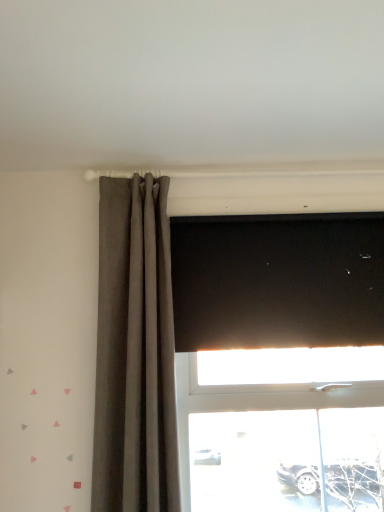
What do you see at coordinates (278, 281) in the screenshot? I see `black matte blind at upper center` at bounding box center [278, 281].

Find the location of a particular element. This screenshot has height=512, width=384. black matte blind at upper center is located at coordinates (278, 281).

At what (x,y) coordinates should I click in order to perform the action: click on matte gray curtain at left. Please return your answer as a coordinate pair (x, y). The image size is (384, 512). Looking at the image, I should click on (135, 352).

What do you see at coordinates (135, 352) in the screenshot? I see `matte gray curtain at left` at bounding box center [135, 352].

Locate an element on the screen. black matte blind at upper center is located at coordinates (278, 281).

Does black matte blind at upper center appear on the right side of matte gray curtain at left?

Indeed, black matte blind at upper center is positioned on the right side of matte gray curtain at left.

In the image, is black matte blind at upper center positioned in front of or behind matte gray curtain at left?

black matte blind at upper center is behind matte gray curtain at left.

Is point (338, 318) closer or farther from the camera than point (103, 306)?

Point (338, 318).

From the image's perspective, is black matte blind at upper center under matte gray curtain at left?

No.

From a real-world perspective, does black matte blind at upper center sit lower than matte gray curtain at left?

Incorrect, from a real-world perspective, black matte blind at upper center is higher than matte gray curtain at left.

Is black matte blind at upper center wider or thinner than matte gray curtain at left?

In the image, black matte blind at upper center appears to be more narrow than matte gray curtain at left.

Is black matte blind at upper center taller than matte gray curtain at left?

In fact, black matte blind at upper center may be shorter than matte gray curtain at left.

Can you confirm if black matte blind at upper center is smaller than matte gray curtain at left?

Indeed, black matte blind at upper center has a smaller size compared to matte gray curtain at left.

In the scene shown: Can we say black matte blind at upper center lies outside matte gray curtain at left?

Yes, black matte blind at upper center is located beyond the bounds of matte gray curtain at left.

Are black matte blind at upper center and matte gray curtain at left beside each other?

No, black matte blind at upper center is not next to matte gray curtain at left.

Is black matte blind at upper center facing towards matte gray curtain at left?

No, black matte blind at upper center is not aimed at matte gray curtain at left.

Where is `blind behind the matte gray curtain at left`? This screenshot has height=512, width=384. blind behind the matte gray curtain at left is located at coordinates (278, 281).

Considering the relative positions of matte gray curtain at left and black matte blind at upper center in the image provided, is matte gray curtain at left to the right of black matte blind at upper center from the viewer's perspective?

Incorrect, matte gray curtain at left is not on the right side of black matte blind at upper center.

Which object is closer to the camera taking this photo, matte gray curtain at left or black matte blind at upper center?

matte gray curtain at left.

Which is more distant, (160,416) or (315,316)?

The point (315,316) is more distant.

From the image's perspective, is matte gray curtain at left located above black matte blind at upper center?

No, from the image's perspective, matte gray curtain at left is not above black matte blind at upper center.

From a real-world perspective, is matte gray curtain at left located beneath black matte blind at upper center?

Indeed, from a real-world perspective, matte gray curtain at left is positioned beneath black matte blind at upper center.

Between matte gray curtain at left and black matte blind at upper center, which one has larger width?

Wider between the two is matte gray curtain at left.

Is matte gray curtain at left taller than black matte blind at upper center?

Yes.

Considering the sizes of objects matte gray curtain at left and black matte blind at upper center in the image provided, who is bigger, matte gray curtain at left or black matte blind at upper center?

Bigger between the two is matte gray curtain at left.

Is matte gray curtain at left situated inside black matte blind at upper center or outside?

matte gray curtain at left is not enclosed by black matte blind at upper center.

Is matte gray curtain at left in contact with black matte blind at upper center?

No, matte gray curtain at left is not next to black matte blind at upper center.

Could you tell me if matte gray curtain at left is turned towards black matte blind at upper center?

No, matte gray curtain at left is not aimed at black matte blind at upper center.

In the scene shown: What's the angular difference between matte gray curtain at left and black matte blind at upper center's facing directions?

0.00107 degrees.

Find the location of a particular element. The image size is (384, 512). curtain that appears in front of the black matte blind at upper center is located at coordinates (135, 352).

The height and width of the screenshot is (512, 384). I want to click on curtain that is below the black matte blind at upper center (from the image's perspective), so click(135, 352).

Locate an element on the screen. This screenshot has height=512, width=384. curtain that appears in front of the black matte blind at upper center is located at coordinates (135, 352).